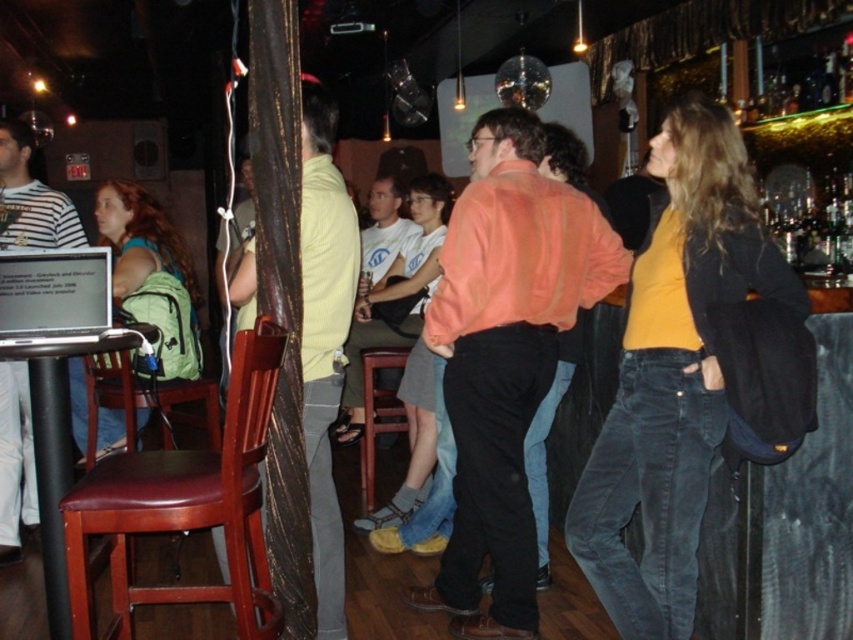
Between striped cotton shirt at left and brown leather bar stool at center, which one is positioned lower?

brown leather bar stool at center

What do you see at coordinates (30, 198) in the screenshot? I see `striped cotton shirt at left` at bounding box center [30, 198].

Where is `striped cotton shirt at left`? This screenshot has height=640, width=853. striped cotton shirt at left is located at coordinates (30, 198).

Identify the location of striped cotton shirt at left. (30, 198).

Does light yellow shirt at center appear on the left side of striped cotton shirt at left?

Incorrect, light yellow shirt at center is not on the left side of striped cotton shirt at left.

Which is below, light yellow shirt at center or striped cotton shirt at left?

striped cotton shirt at left is lower down.

Does point (322, 208) lie in front of point (22, 193)?

That is True.

Find the location of a particular element. This screenshot has height=640, width=853. light yellow shirt at center is located at coordinates (323, 339).

What do you see at coordinates (505, 356) in the screenshot? I see `matte orange shirt at center` at bounding box center [505, 356].

Is matte orange shirt at center smaller than white cotton shirt at center?

Yes.

Is point (456, 342) positioned before point (412, 332)?

Yes, it is in front of point (412, 332).

Find the location of a particular element. matte orange shirt at center is located at coordinates (505, 356).